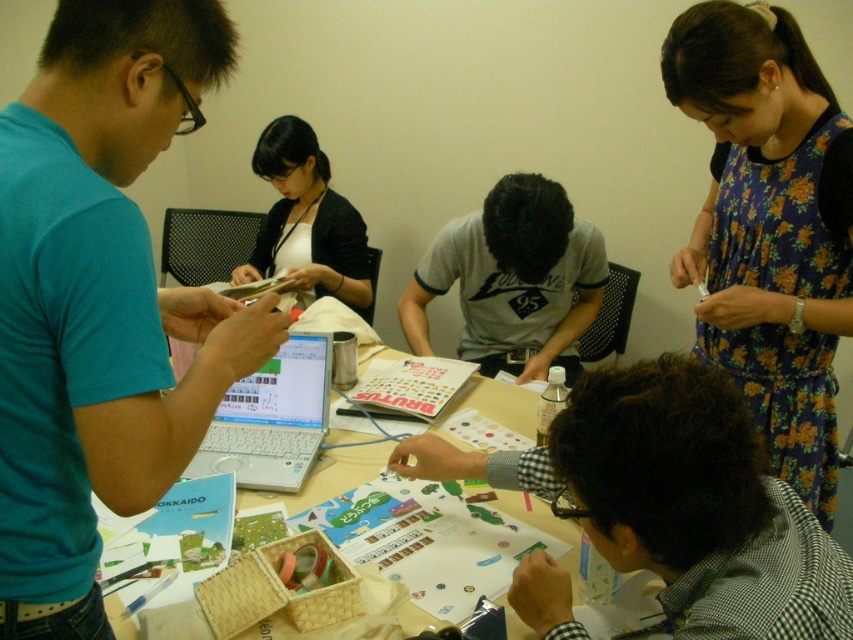
Who is higher up, gray cotton shirt at center or black matte shirt at upper center?

black matte shirt at upper center is higher up.

Who is more forward, (x=461, y=310) or (x=355, y=301)?

Positioned in front is point (x=355, y=301).

What do you see at coordinates (514, 280) in the screenshot? I see `gray cotton shirt at center` at bounding box center [514, 280].

Image resolution: width=853 pixels, height=640 pixels. Identify the location of gray cotton shirt at center. (514, 280).

Is floral dress at upper right thinner than black matte shirt at upper center?

Yes, floral dress at upper right is thinner than black matte shirt at upper center.

Is point (840, 141) closer to viewer compared to point (329, 269)?

Yes, point (840, 141) is in front of point (329, 269).

The image size is (853, 640). In order to click on floral dress at upper right in this screenshot , I will do `click(769, 227)`.

The height and width of the screenshot is (640, 853). I want to click on floral dress at upper right, so click(x=769, y=227).

Is blue matte shirt at left thinner than black matte shirt at upper center?

Indeed, blue matte shirt at left has a lesser width compared to black matte shirt at upper center.

Does blue matte shirt at left have a greater width compared to black matte shirt at upper center?

No.

You are a GUI agent. You are given a task and a screenshot of the screen. Output one action in this format:
    pyautogui.click(x=<x>, y=<y>)
    Task: Click on the blue matte shirt at left
    This screenshot has height=640, width=853.
    Given the screenshot: What is the action you would take?
    pyautogui.click(x=100, y=300)

Locate an element on the screen. The image size is (853, 640). blue matte shirt at left is located at coordinates (100, 300).